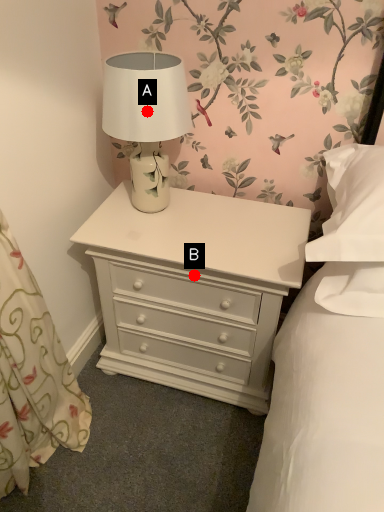
Question: Two points are circled on the image, labeled by A and B beside each circle. Which point is closer to the camera?

Choices:
 (A) A is closer
 (B) B is closer

Answer: (A)